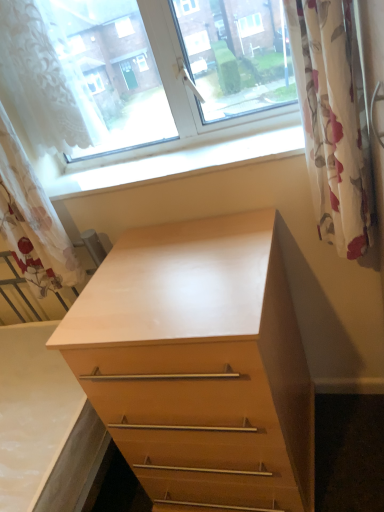
Question: Based on their sizes in the image, would you say white lace curtain at left, the 1th curtain in the left-to-right sequence, is bigger or smaller than white lace curtain at upper left?

Choices:
 (A) big
 (B) small

Answer: (A)

Question: From the image's perspective, is white lace curtain at left, the 1th curtain in the left-to-right sequence, positioned above or below white lace curtain at upper left?

Choices:
 (A) above
 (B) below

Answer: (B)

Question: Which of these objects is positioned farthest from the white lace curtain at upper left?

Choices:
 (A) white smooth window sill at upper center
 (B) light wood chest of drawers at center
 (C) floral fabric curtain at right, which is the first curtain in right-to-left order
 (D) white lace curtain at left, the 1th curtain in the left-to-right sequence

Answer: (C)

Question: Considering the real-world distances, which object is closest to the white smooth window sill at upper center?

Choices:
 (A) white lace curtain at upper left
 (B) floral fabric curtain at right, positioned as the second curtain in left-to-right order
 (C) white lace curtain at left, which is the second curtain from right to left
 (D) light wood chest of drawers at center

Answer: (C)